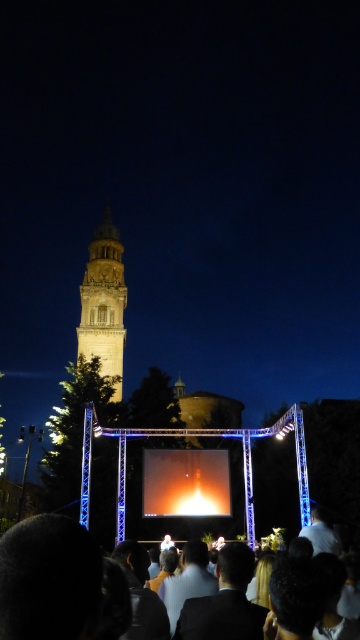
Question: Which of these objects is positioned closest to the light beige stone bell tower at center?

Choices:
 (A) dark suit crowd at lower center
 (B) shiny orange rocket at center

Answer: (B)

Question: Can you confirm if dark suit crowd at lower center is wider than light beige stone bell tower at center?

Choices:
 (A) yes
 (B) no

Answer: (A)

Question: Is light beige stone bell tower at center above shiny orange rocket at center?

Choices:
 (A) yes
 (B) no

Answer: (A)

Question: Observing the image, what is the correct spatial positioning of dark suit crowd at lower center in reference to shiny orange rocket at center?

Choices:
 (A) below
 (B) above

Answer: (A)

Question: Among these points, which one is farthest from the camera?

Choices:
 (A) (212, 512)
 (B) (65, 552)

Answer: (A)

Question: Which of the following is the closest to the observer?

Choices:
 (A) light beige stone bell tower at center
 (B) shiny orange rocket at center

Answer: (B)